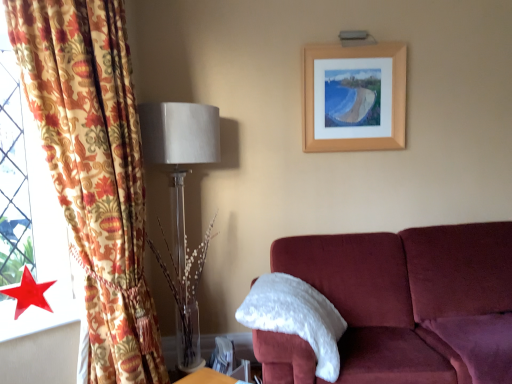
Question: Is floral fabric curtain at left facing away from wooden picture frame at upper center?

Choices:
 (A) no
 (B) yes

Answer: (A)

Question: Is floral fabric curtain at left not close to wooden picture frame at upper center?

Choices:
 (A) no
 (B) yes

Answer: (B)

Question: From a real-world perspective, is floral fabric curtain at left physically above wooden picture frame at upper center?

Choices:
 (A) no
 (B) yes

Answer: (A)

Question: Is floral fabric curtain at left shorter than wooden picture frame at upper center?

Choices:
 (A) yes
 (B) no

Answer: (B)

Question: Is floral fabric curtain at left thinner than wooden picture frame at upper center?

Choices:
 (A) yes
 (B) no

Answer: (B)

Question: Does point (318, 147) appear closer or farther from the camera than point (289, 284)?

Choices:
 (A) farther
 (B) closer

Answer: (A)

Question: Is wooden picture frame at upper center inside the boundaries of white fluffy pillow at right, or outside?

Choices:
 (A) inside
 (B) outside

Answer: (B)

Question: Is wooden picture frame at upper center wider or thinner than white fluffy pillow at right?

Choices:
 (A) wide
 (B) thin

Answer: (B)

Question: In terms of height, does wooden picture frame at upper center look taller or shorter compared to white fluffy pillow at right?

Choices:
 (A) tall
 (B) short

Answer: (A)

Question: From the image's perspective, is red glossy star at lower left positioned above or below wooden picture frame at upper center?

Choices:
 (A) below
 (B) above

Answer: (A)

Question: Considering the positions of red glossy star at lower left and wooden picture frame at upper center in the image, is red glossy star at lower left wider or thinner than wooden picture frame at upper center?

Choices:
 (A) thin
 (B) wide

Answer: (B)

Question: From a real-world perspective, is red glossy star at lower left above or below wooden picture frame at upper center?

Choices:
 (A) below
 (B) above

Answer: (A)

Question: Is red glossy star at lower left inside or outside of wooden picture frame at upper center?

Choices:
 (A) outside
 (B) inside

Answer: (A)

Question: In terms of size, does red glossy star at lower left appear bigger or smaller than white fluffy pillow at right?

Choices:
 (A) small
 (B) big

Answer: (A)

Question: Is red glossy star at lower left in front of or behind white fluffy pillow at right in the image?

Choices:
 (A) front
 (B) behind

Answer: (A)